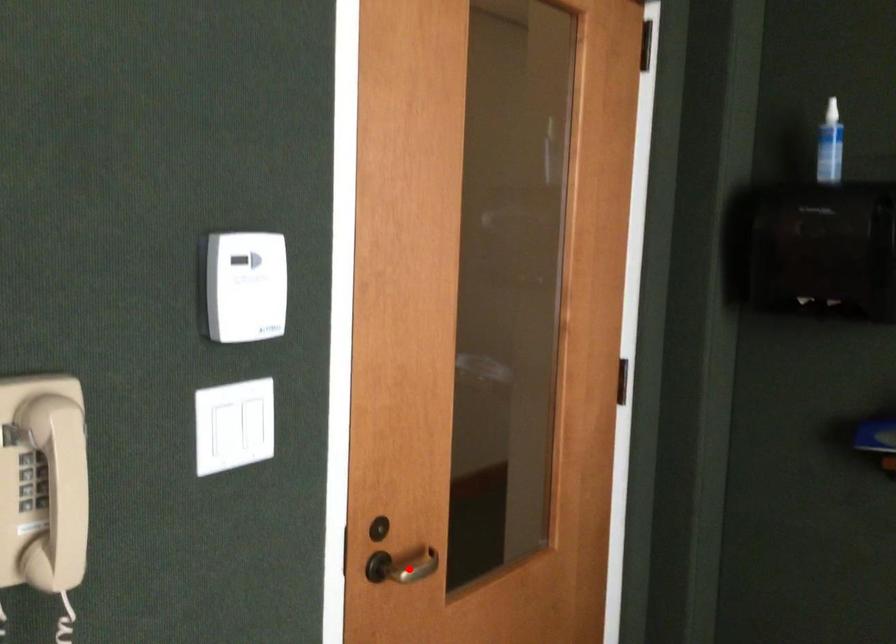
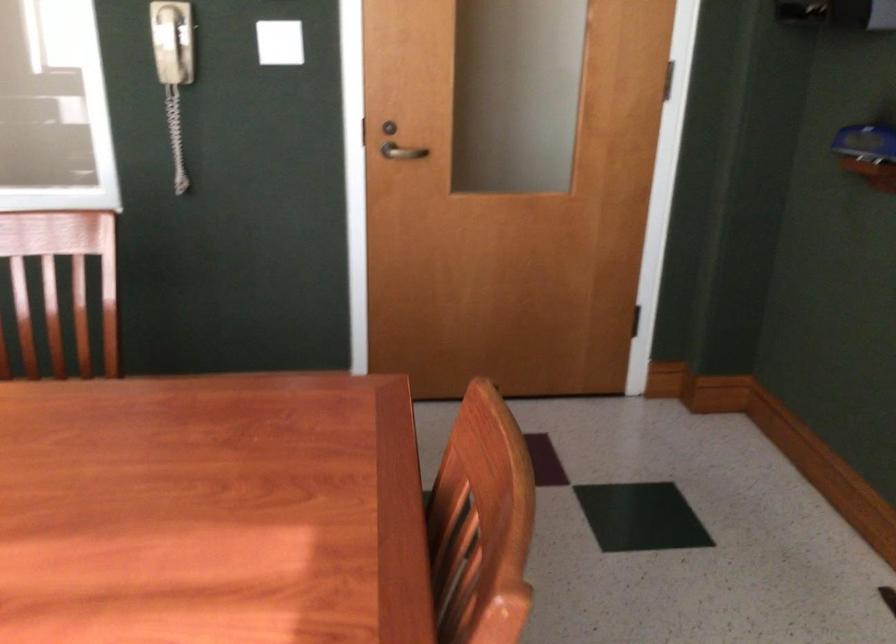
Locate, in the second image, the point that corresponds to the highlighted location in the first image.

(401, 152)